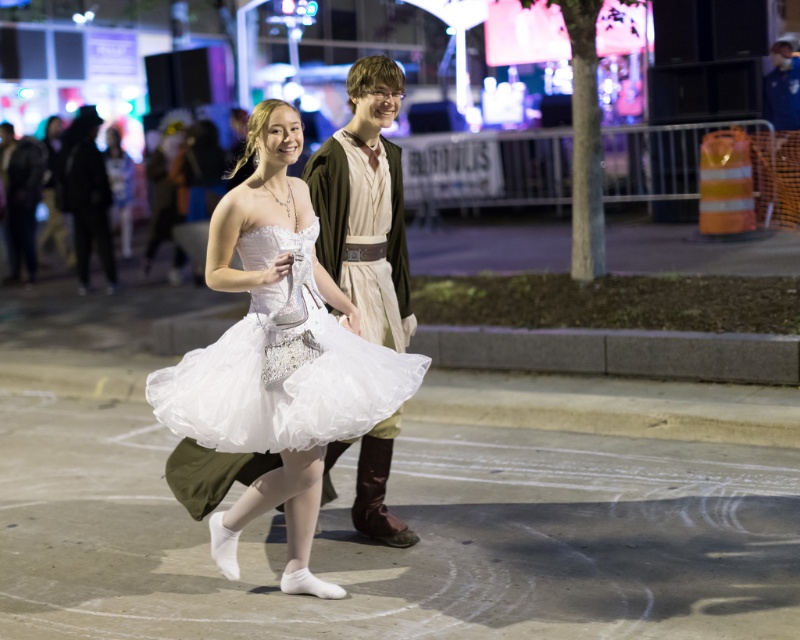
Can you confirm if white tulle skirt at center is positioned above white tulle dress at center?

Incorrect, white tulle skirt at center is not positioned above white tulle dress at center.

Which is in front, point (296, 472) or point (308, 280)?

Point (308, 280)

Between point (285, 230) and point (248, 442), which one is positioned in front?

Positioned in front is point (248, 442).

The image size is (800, 640). In order to click on white tulle skirt at center in this screenshot , I will do `click(276, 358)`.

Is brown leather belt at center to the left of matte white dress at center from the viewer's perspective?

In fact, brown leather belt at center is to the right of matte white dress at center.

Is brown leather belt at center smaller than matte white dress at center?

Indeed, brown leather belt at center has a smaller size compared to matte white dress at center.

Locate an element on the screen. The height and width of the screenshot is (640, 800). brown leather belt at center is located at coordinates (366, 204).

Does point (189, 412) come closer to viewer compared to point (82, 228)?

Yes, it is.

Does white tulle dress at center appear on the left side of matte white dress at center?

In fact, white tulle dress at center is to the right of matte white dress at center.

The height and width of the screenshot is (640, 800). In order to click on white tulle dress at center in this screenshot , I will do `click(282, 371)`.